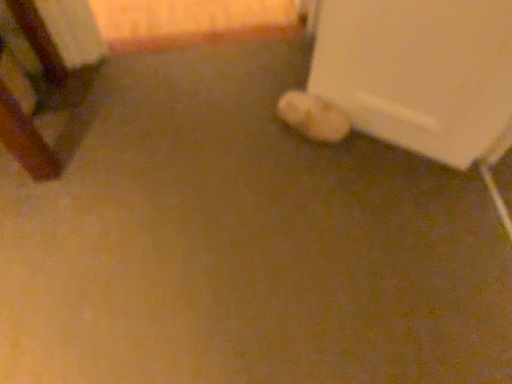
At what (x,y) coordinates should I click in order to perform the action: click on fluffy white cat at lower right. Please return your answer as a coordinate pair (x, y). This screenshot has width=512, height=384. Looking at the image, I should click on (313, 117).

Measure the distance between point (295, 91) and camera.

Point (295, 91) and camera are 5.00 feet apart from each other.

Image resolution: width=512 pixels, height=384 pixels. Describe the element at coordinates (313, 117) in the screenshot. I see `fluffy white cat at lower right` at that location.

Locate an element on the screen. The image size is (512, 384). fluffy white cat at lower right is located at coordinates (313, 117).